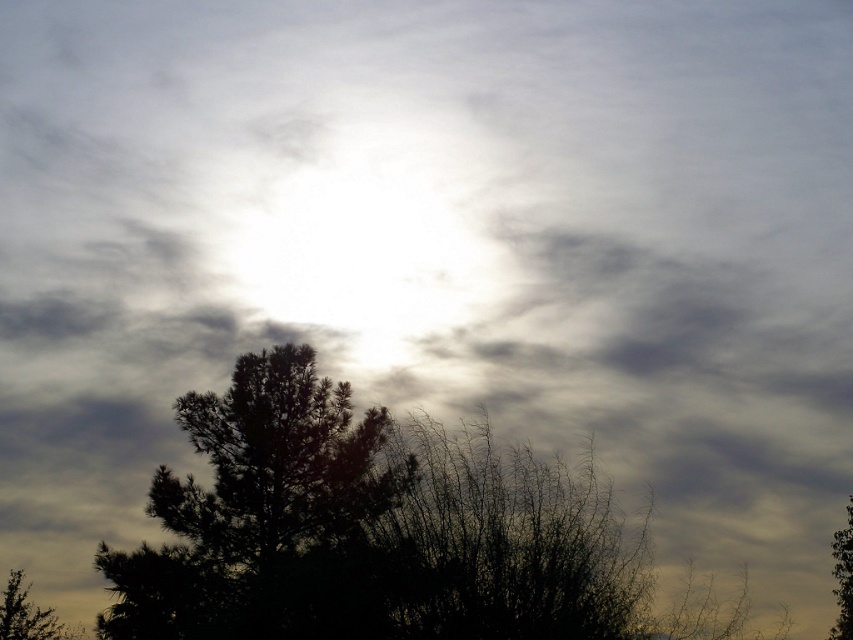
Between dark green textured tree at lower left and green leafy tree at lower right, which one is positioned higher?

Result: dark green textured tree at lower left is above.

Does dark green textured tree at lower left appear over green leafy tree at lower right?

Indeed, dark green textured tree at lower left is positioned over green leafy tree at lower right.

Find the location of a particular element. dark green textured tree at lower left is located at coordinates (264, 515).

Is dark green textured tree at lower left positioned in front of dark green leafy tree at lower left?

Yes, dark green textured tree at lower left is closer to the viewer.

Is dark green textured tree at lower left below dark green leafy tree at lower left?

No.

Does point (329, 461) come farther from viewer compared to point (10, 620)?

No, it is in front of (10, 620).

At what (x,y) coordinates should I click in order to perform the action: click on dark green textured tree at lower left. Please return your answer as a coordinate pair (x, y). The image size is (853, 640). Looking at the image, I should click on (264, 515).

Consider the image. Does dark green leafy tree at lower left appear over green leafy tree at lower right?

No.

Between dark green leafy tree at lower left and green leafy tree at lower right, which one appears on the left side from the viewer's perspective?

dark green leafy tree at lower left is more to the left.

The width and height of the screenshot is (853, 640). Describe the element at coordinates (28, 616) in the screenshot. I see `dark green leafy tree at lower left` at that location.

The width and height of the screenshot is (853, 640). Find the location of `dark green leafy tree at lower left`. dark green leafy tree at lower left is located at coordinates (28, 616).